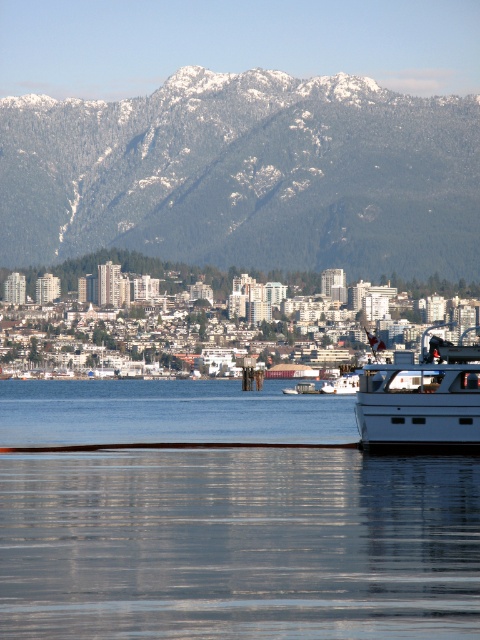
Question: Can you confirm if snowy forested mountain at upper center is positioned to the left of white matte boat at right?

Choices:
 (A) no
 (B) yes

Answer: (B)

Question: Which point is farther from the camera taking this photo?

Choices:
 (A) (95, 189)
 (B) (412, 420)

Answer: (A)

Question: Can you confirm if snowy forested mountain at upper center is thinner than white matte boat at right?

Choices:
 (A) no
 (B) yes

Answer: (A)

Question: Does snowy forested mountain at upper center have a greater width compared to white matte boat at right?

Choices:
 (A) yes
 (B) no

Answer: (A)

Question: Which of the following is the closest to the observer?

Choices:
 (A) snowy forested mountain at upper center
 (B) white matte boat at right

Answer: (B)

Question: Which point is closer to the camera?

Choices:
 (A) (459, 445)
 (B) (6, 208)

Answer: (A)